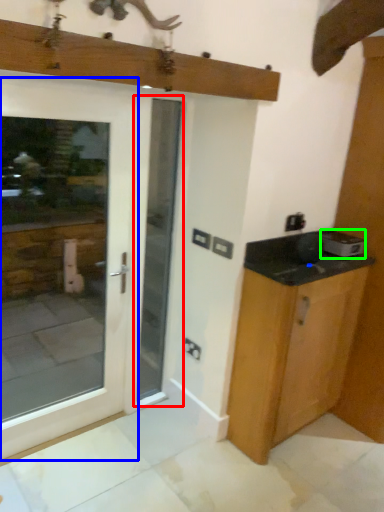
Question: Considering the real-world distances, which object is farthest from screen door (highlighted by a red box)? door (highlighted by a blue box) or appliance (highlighted by a green box)?

Choices:
 (A) door
 (B) appliance

Answer: (A)